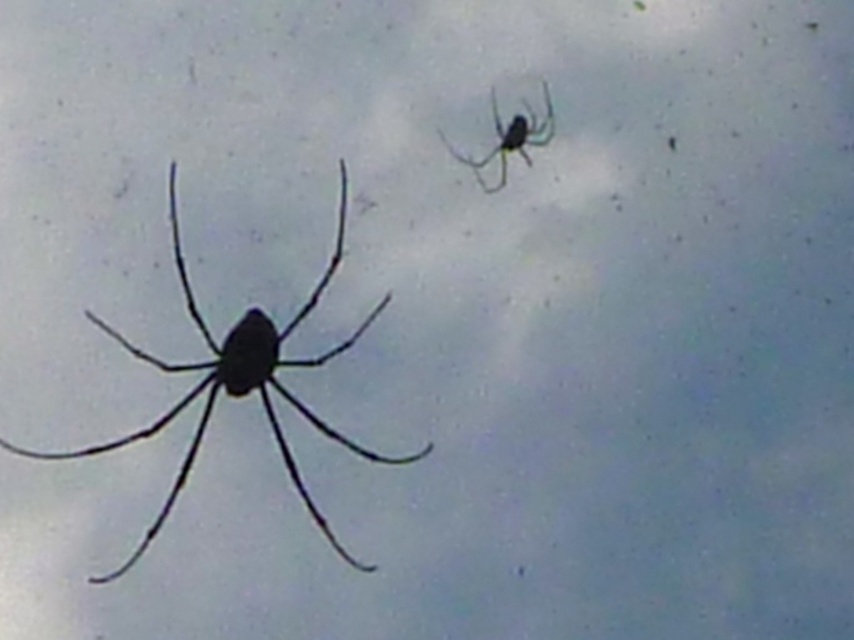
Question: Can you confirm if black matte spider at left is positioned above green glossy spider at upper right?

Choices:
 (A) yes
 (B) no

Answer: (B)

Question: Which point is farther to the camera?

Choices:
 (A) (215, 358)
 (B) (518, 140)

Answer: (B)

Question: Can you confirm if black matte spider at left is positioned to the right of green glossy spider at upper right?

Choices:
 (A) yes
 (B) no

Answer: (B)

Question: Which of the following is the farthest from the observer?

Choices:
 (A) (243, 316)
 (B) (518, 116)

Answer: (B)

Question: Where is black matte spider at left located in relation to green glossy spider at upper right in the image?

Choices:
 (A) right
 (B) left

Answer: (B)